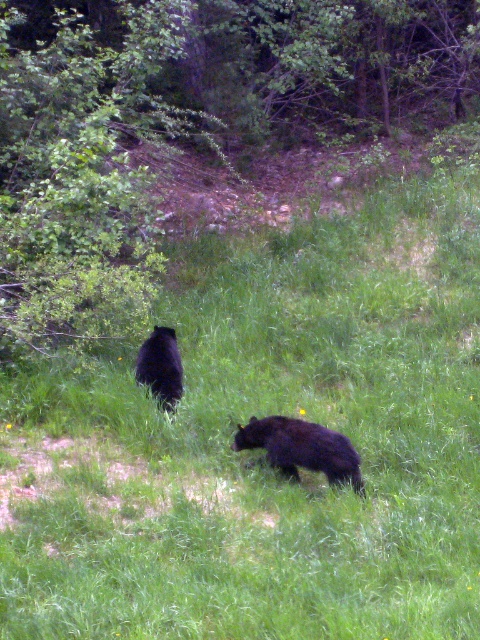
You are a hiker who has spotted both the black furry bear at lower center and the black fuzzy bear at center in the distance. Which bear is positioned more to the east if you are facing the scene?

The black furry bear at lower center is to the right of the black fuzzy bear at center. Since you are facing the scene, the right side corresponds to the east direction, so the black furry bear at lower center is positioned more to the east.

You are standing at the point closer to the camera in this scene. There are two points marked in the image, one at coordinates point (70,156) and another at point (139,358). Which point are you currently standing at?

You are standing at point (70,156) because it is further to the camera than point (139,358).

Based on the photo, you are observing two black bears in a grassy area. The black furry bear at lower center and the black fuzzy bear at center are both present. Which bear is taller?

The black fuzzy bear at center is taller than the black furry bear at lower center.